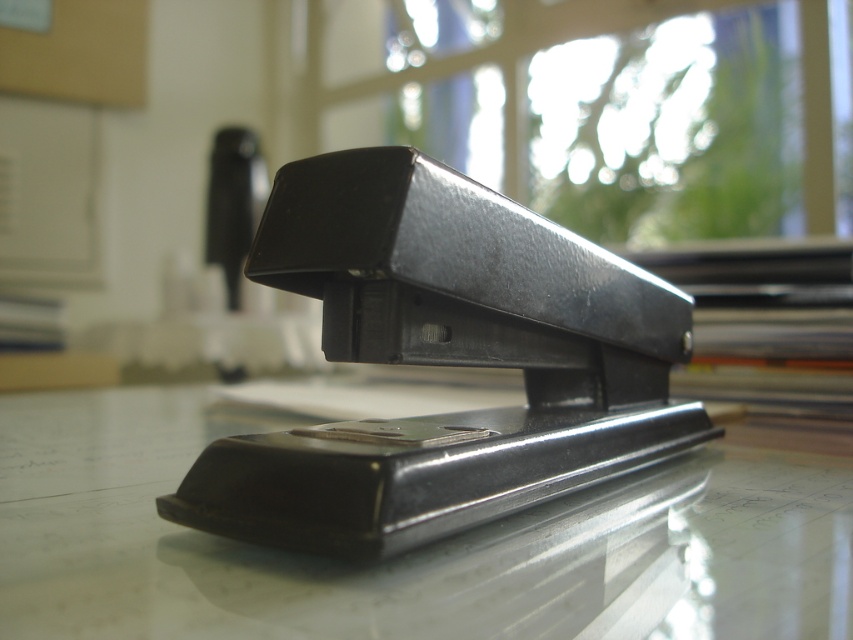
Question: Observing the image, what is the correct spatial positioning of black glossy stapler at center in reference to black plastic stapler at center?

Choices:
 (A) below
 (B) above

Answer: (A)

Question: Which object is farther from the camera taking this photo?

Choices:
 (A) black glossy stapler at center
 (B) black plastic stapler at center

Answer: (B)

Question: Which point is farther to the camera?

Choices:
 (A) (749, 460)
 (B) (448, 531)

Answer: (A)

Question: Observing the image, what is the correct spatial positioning of black glossy stapler at center in reference to black plastic stapler at center?

Choices:
 (A) below
 (B) above

Answer: (A)

Question: Which of the following is the closest to the observer?

Choices:
 (A) black plastic stapler at center
 (B) black glossy stapler at center

Answer: (B)

Question: Is the position of black glossy stapler at center less distant than that of black plastic stapler at center?

Choices:
 (A) no
 (B) yes

Answer: (B)